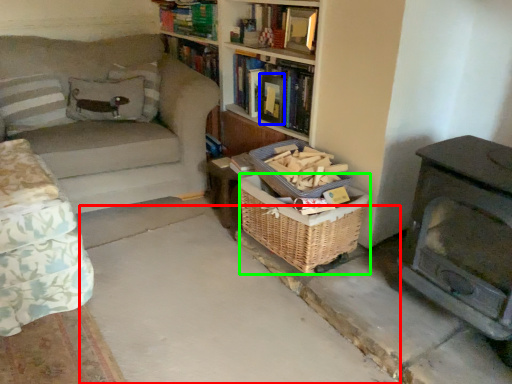
Question: Which object is the closest to the concrete (highlighted by a red box)? Choose among these: paperback book (highlighted by a blue box) or basket (highlighted by a green box).

Choices:
 (A) paperback book
 (B) basket

Answer: (B)